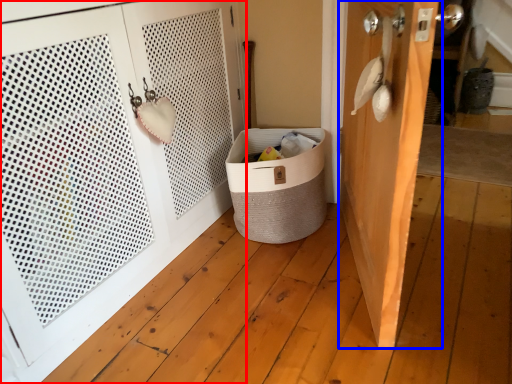
Question: Which object is further to the camera taking this photo, door (highlighted by a red box) or door (highlighted by a blue box)?

Choices:
 (A) door
 (B) door

Answer: (B)